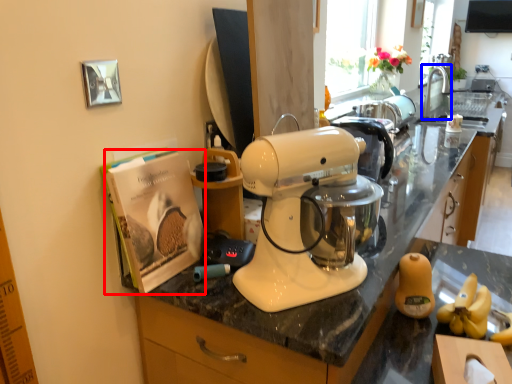
Question: Which object is closer to the camera taking this photo, magazine (highlighted by a red box) or faucet (highlighted by a blue box)?

Choices:
 (A) magazine
 (B) faucet

Answer: (A)